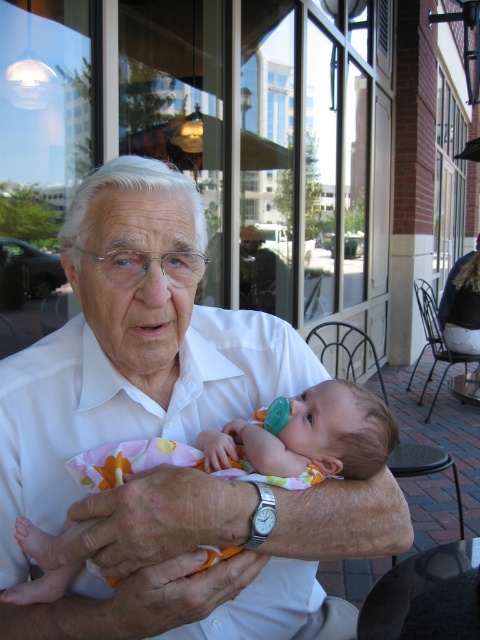
You are a photographer trying to capture the elderly man and the baby in the scene. You need to ensure that both the white smooth shirt at center and the teal plastic pacifier at center are clearly visible in your photo. Given their size difference, which object might require you to adjust your focus more carefully to ensure it doesn not get lost in the image?

The teal plastic pacifier at center is smaller than the white smooth shirt at center, so you may need to adjust your focus more carefully to ensure it doesn not get lost in the image.

You are an architect designing a new building and want to ensure that the large glass windows in the design will reflect the white smooth shirt at center exactly at point 0.683, 0.348. What information do you need to know to achieve this?

To ensure the large glass windows reflect the white smooth shirt at center exactly at point (167, 436), you need to know the position and angle of the windows relative to the shirt and the lighting conditions affecting the reflection.